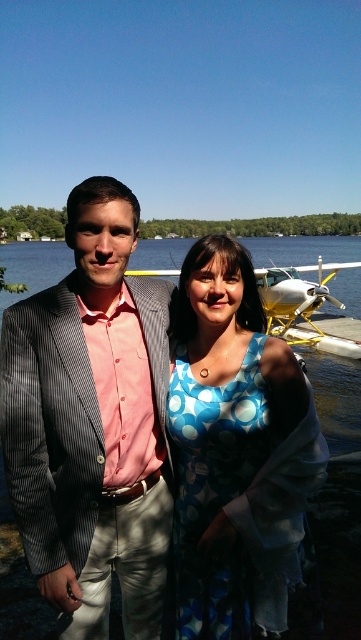
You are a photographer trying to capture a photo of the matte pink shirt at center and the clear water at center. Since you want to focus on the shirt, which object should you position closer to the camera?

The matte pink shirt at center has a lesser width compared to clear water at center, so you should position the matte pink shirt at center closer to the camera to make it appear larger in the photo.

You are a photographer trying to capture the matte pink shirt at center in the image. Based on the coordinates provided, where should you focus your camera?

The matte pink shirt at center is located at coordinates point (x=92, y=422), so you should focus your camera there.